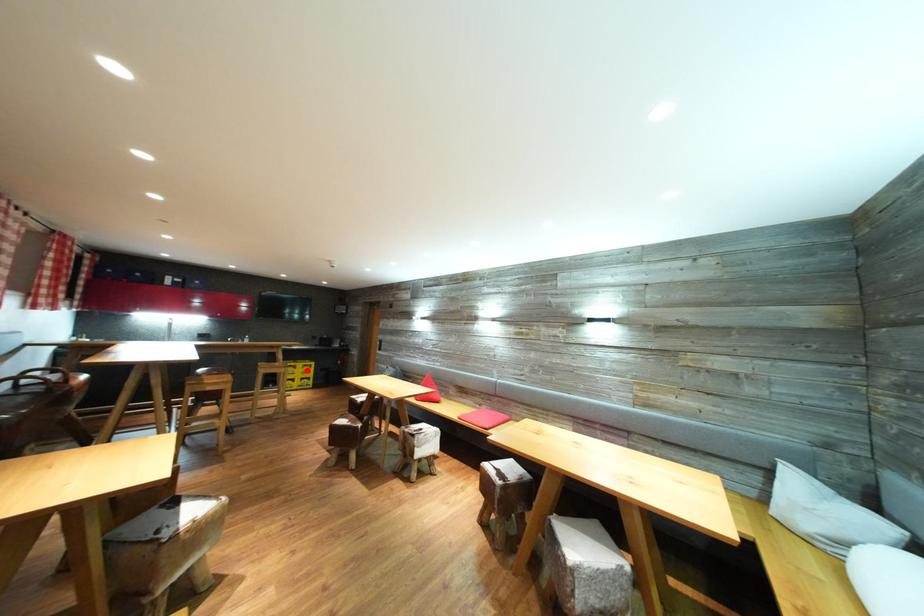
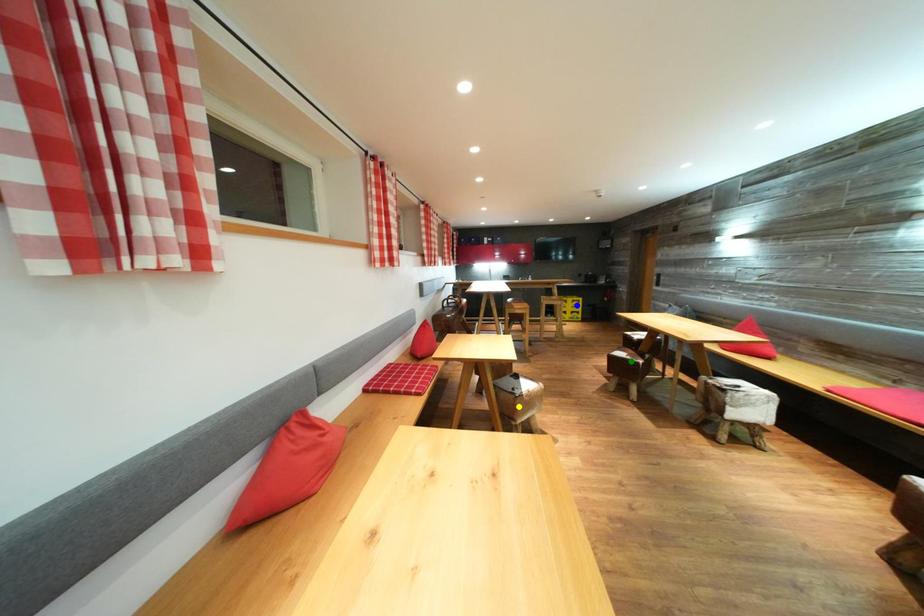
Question: I am providing you with two images of the same scene from different viewpoints. A red point is marked on the first image. You are given multiple points on the second image. Can you choose the point in image 2 that corresponds to the point in image 1?

Choices:
 (A) blue point
 (B) yellow point
 (C) green point

Answer: (A)